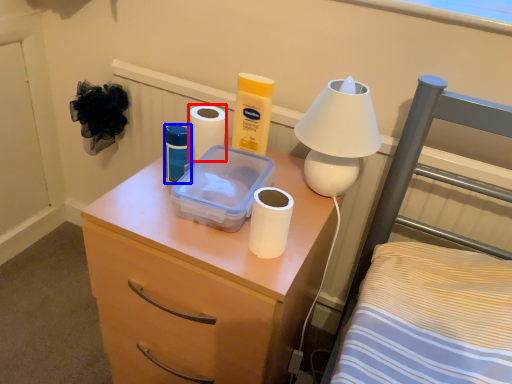
Question: Which object appears closest to the camera in this image, toilet paper (highlighted by a red box) or toiletry (highlighted by a blue box)?

Choices:
 (A) toilet paper
 (B) toiletry

Answer: (B)